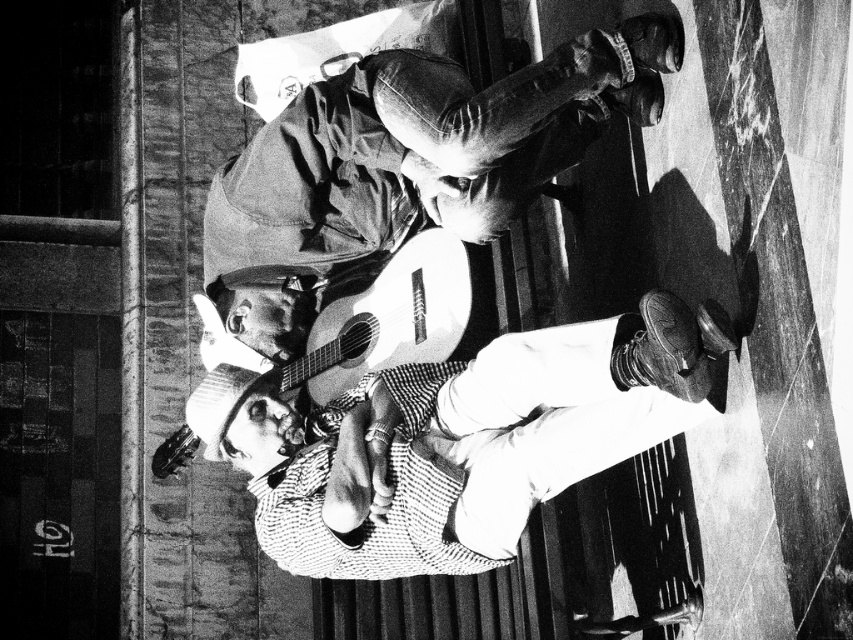
You are a photographer adjusting your camera settings to focus on two points in the scene. The first point is point [248,381] and the second is point [372,256]. Which point should you focus on first if you want to ensure both are in focus?

You should focus on point [248,381] first because it is closer to the camera than point [372,256]. This ensures that the closer point is in focus, and the farther point will also be in focus within the depth of field.

You are standing at the front of the stage and see the checkered fabric shirt at center and the leather jacket at upper center. Which one is farther away from you?

The checkered fabric shirt at center is 9.51 meters away from the leather jacket at upper center. Since you are at the front of the stage, the one farther away would depend on their positions relative to you. However, the description states the checkered fabric shirt at center is 9.51 meters from the leather jacket at upper center, but without knowing your exact position, it is impossible to determine which is farther. However, given the typical stage setup, the leather jacket at upper center might be more.